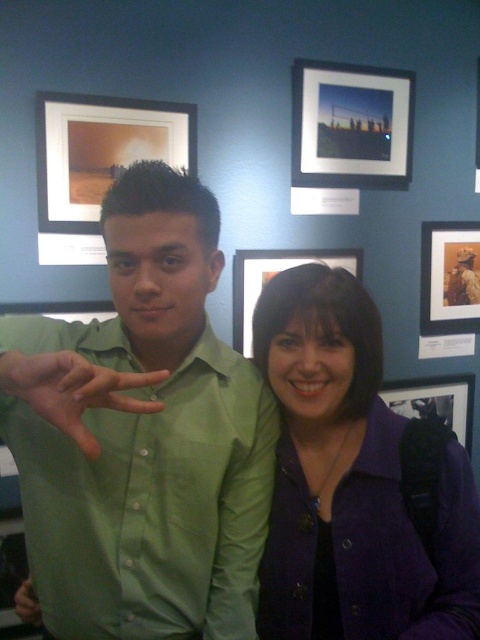
Can you confirm if matte glass picture frame at upper center is wider than matte plastic picture frame at center?

No.

Which is in front, point (326, 150) or point (260, 285)?

Point (260, 285)

In order to click on matte glass picture frame at upper center in this screenshot , I will do click(x=350, y=124).

Does purple fabric jacket at center have a greater width compared to matte green shirt at lower left?

Yes, purple fabric jacket at center is wider than matte green shirt at lower left.

Which is behind, point (367, 296) or point (25, 580)?

The point (25, 580) is more distant.

Where is `purple fabric jacket at center`? purple fabric jacket at center is located at coordinates (357, 481).

Can you confirm if matte wooden frame at upper left is shorter than matte glass picture frame at upper center?

In fact, matte wooden frame at upper left may be taller than matte glass picture frame at upper center.

Locate an element on the screen. matte wooden frame at upper left is located at coordinates (100, 150).